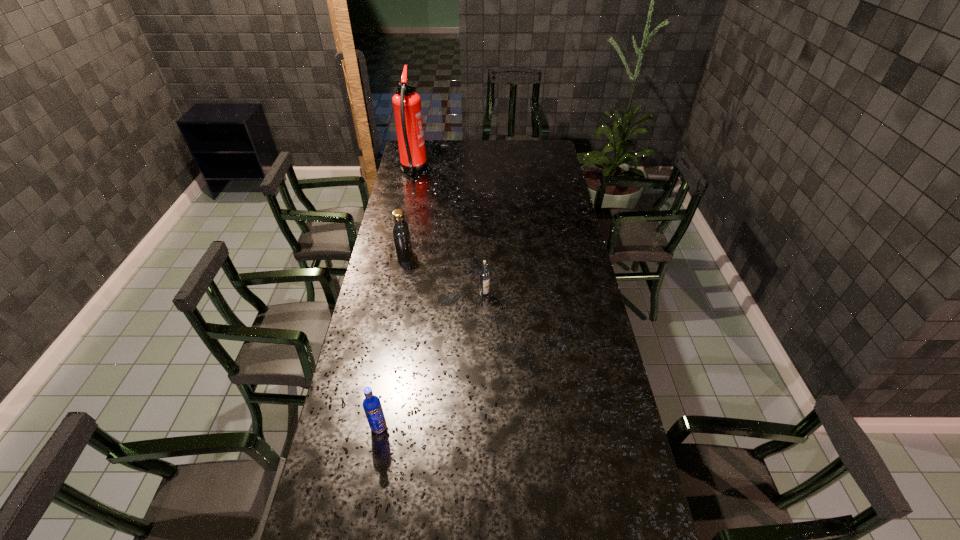
Where is `free space between the nearest vodka and the farthest vodka`? Image resolution: width=960 pixels, height=540 pixels. free space between the nearest vodka and the farthest vodka is located at coordinates (392, 341).

In order to click on free point between the nearest object and the tallest object in this screenshot , I will do `click(396, 299)`.

Where is `vacant point located between the second nearest object and the nearest vodka`? vacant point located between the second nearest object and the nearest vodka is located at coordinates (432, 361).

Find the location of `vacant area that lies between the nearest object and the shortest vodka`. vacant area that lies between the nearest object and the shortest vodka is located at coordinates (432, 361).

Where is `free space between the second farthest object and the shortest vodka`? free space between the second farthest object and the shortest vodka is located at coordinates (444, 275).

The image size is (960, 540). Find the location of `empty space that is in between the nearest object and the tallest object`. empty space that is in between the nearest object and the tallest object is located at coordinates (396, 299).

Find the location of a particular element. The image size is (960, 540). the third closest object relative to the nearest object is located at coordinates (407, 104).

Identify which object is the second nearest to the shortest object. Please provide its 2D coordinates. Your answer should be formatted as a tuple, i.e. [(x, y)], where the tuple contains the x and y coordinates of a point satisfying the conditions above.

[(372, 406)]

Find the location of a particular element. Image resolution: width=960 pixels, height=540 pixels. the closest vodka to the rightmost object is located at coordinates (401, 234).

I want to click on the closest vodka to the second nearest object, so click(x=401, y=234).